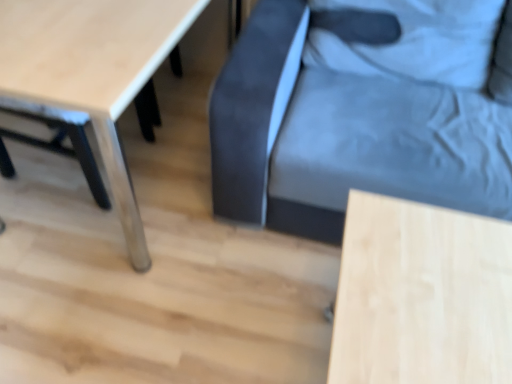
Question: Could you tell me if light wood table at lower left, arranged as the second table when viewed from the right, is turned towards dark blue fabric swivel chair at center?

Choices:
 (A) yes
 (B) no

Answer: (A)

Question: From the image's perspective, is light wood table at lower left, arranged as the second table when viewed from the right, beneath dark blue fabric swivel chair at center?

Choices:
 (A) no
 (B) yes

Answer: (A)

Question: Considering the relative sizes of light wood table at lower left, arranged as the second table when viewed from the right, and dark blue fabric swivel chair at center in the image provided, is light wood table at lower left, arranged as the second table when viewed from the right, taller than dark blue fabric swivel chair at center?

Choices:
 (A) no
 (B) yes

Answer: (A)

Question: Can you confirm if light wood table at lower left, arranged as the second table when viewed from the right, is wider than dark blue fabric swivel chair at center?

Choices:
 (A) yes
 (B) no

Answer: (B)

Question: Is light wood table at lower left, arranged as the second table when viewed from the right, positioned behind dark blue fabric swivel chair at center?

Choices:
 (A) no
 (B) yes

Answer: (A)

Question: From a real-world perspective, is light wood table at lower left, placed as the 1th table when sorted from left to right, over dark blue fabric swivel chair at center?

Choices:
 (A) no
 (B) yes

Answer: (A)

Question: Does dark blue fabric swivel chair at center lie in front of light wood table at lower left, placed as the 1th table when sorted from left to right?

Choices:
 (A) yes
 (B) no

Answer: (B)

Question: Is dark blue fabric swivel chair at center not near light wood table at lower left, placed as the 1th table when sorted from left to right?

Choices:
 (A) no
 (B) yes

Answer: (A)

Question: Is dark blue fabric swivel chair at center oriented away from light wood table at lower left, arranged as the second table when viewed from the right?

Choices:
 (A) no
 (B) yes

Answer: (A)

Question: Is dark blue fabric swivel chair at center outside light wood table at lower left, placed as the 1th table when sorted from left to right?

Choices:
 (A) yes
 (B) no

Answer: (A)

Question: Considering the relative sizes of dark blue fabric swivel chair at center and light wood table at lower left, placed as the 1th table when sorted from left to right, in the image provided, is dark blue fabric swivel chair at center shorter than light wood table at lower left, placed as the 1th table when sorted from left to right,?

Choices:
 (A) no
 (B) yes

Answer: (A)

Question: From the image's perspective, would you say dark blue fabric swivel chair at center is positioned over light wood table at lower left, arranged as the second table when viewed from the right?

Choices:
 (A) no
 (B) yes

Answer: (A)

Question: Is light wood table at lower right, the 1th table viewed from the right, thinner than dark blue fabric swivel chair at center?

Choices:
 (A) no
 (B) yes

Answer: (B)